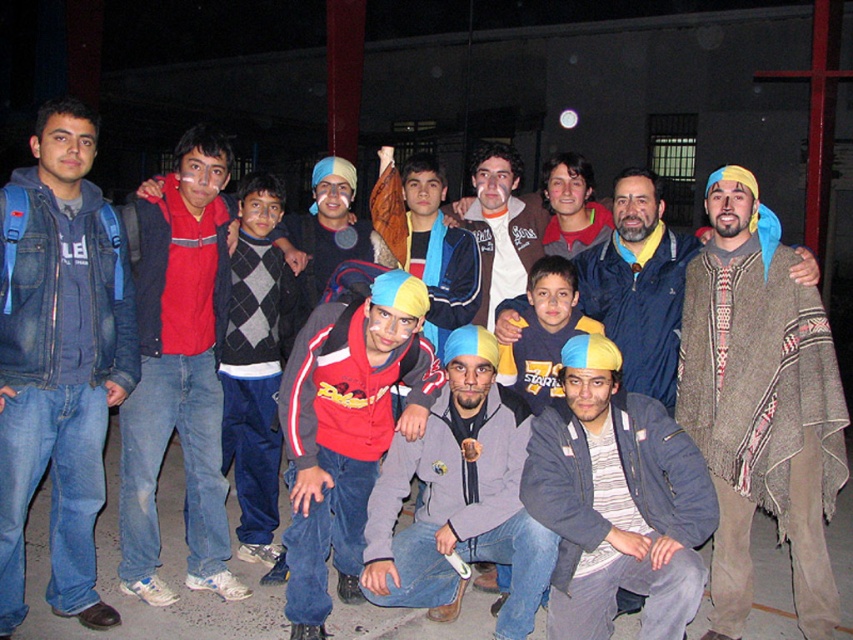
Question: Can you confirm if blue-yellow knit cap at lower center is smaller than matte gray hoodie at center?

Choices:
 (A) yes
 (B) no

Answer: (A)

Question: Can you confirm if denim jacket at left is thinner than matte gray hoodie at center?

Choices:
 (A) no
 (B) yes

Answer: (B)

Question: Which object appears closest to the camera in this image?

Choices:
 (A) matte white mask at center
 (B) denim jacket at left

Answer: (B)

Question: Considering the real-world distances, which object is closest to the denim jacket at left?

Choices:
 (A) blue-yellow knit cap at lower center
 (B) matte gray hoodie at center
 (C) reddish-brown leather jacket at center
 (D) knitted wool poncho at center

Answer: (B)

Question: Where is knitted wool poncho at center located in relation to matte red jacket at center in the image?

Choices:
 (A) left
 (B) right

Answer: (B)

Question: Which of the following is the closest to the observer?

Choices:
 (A) matte red jacket at center
 (B) reddish-brown leather jacket at center

Answer: (A)